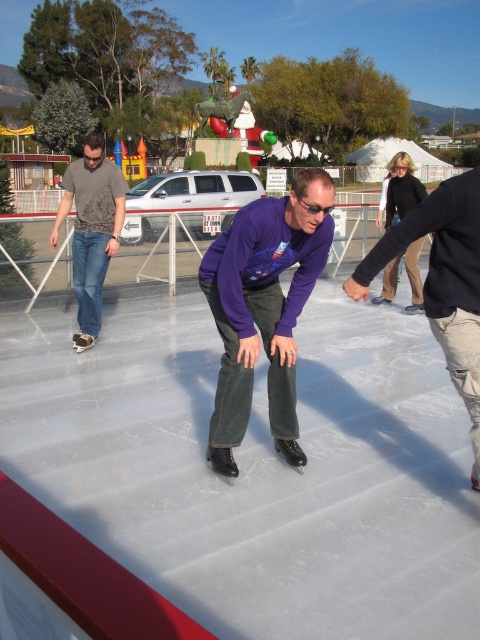
Is purple matte shirt at center to the left of dark gray jeans at center from the viewer's perspective?

Yes, purple matte shirt at center is to the left of dark gray jeans at center.

Does purple matte shirt at center have a larger size compared to dark gray jeans at center?

Correct, purple matte shirt at center is larger in size than dark gray jeans at center.

Measure the distance between point (238, 262) and camera.

The distance of point (238, 262) from camera is 10.02 feet.

At what (x,y) coordinates should I click in order to perform the action: click on purple matte shirt at center. Please return your answer as a coordinate pair (x, y). The width and height of the screenshot is (480, 640). Looking at the image, I should click on (264, 308).

Is point (177, 436) positioned in front of point (84, 150)?

Yes, point (177, 436) is closer to viewer.

Is point (358, 504) positioned behind point (72, 262)?

No, it is in front of (72, 262).

Is point (263, 509) positioned after point (98, 285)?

No, it is in front of (98, 285).

I want to click on matte black ice at center, so click(x=256, y=468).

Does matte black ice at center have a lesser height compared to dark gray jeans at center?

Correct, matte black ice at center is not as tall as dark gray jeans at center.

Image resolution: width=480 pixels, height=640 pixels. In order to click on matte black ice at center in this screenshot , I will do `click(256, 468)`.

Where is `matte black ice at center`? The width and height of the screenshot is (480, 640). matte black ice at center is located at coordinates (256, 468).